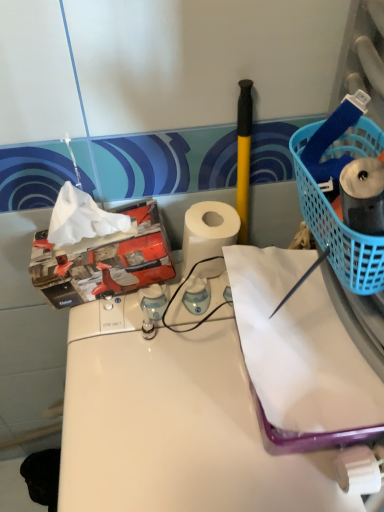
Question: From the image's perspective, is white glossy counter at center positioned above or below white matte paper towel at center?

Choices:
 (A) below
 (B) above

Answer: (A)

Question: Is point (195, 449) closer or farther from the camera than point (190, 249)?

Choices:
 (A) farther
 (B) closer

Answer: (B)

Question: Estimate the real-world distances between objects in this image. Which object is farther from the white matte paper towel at center?

Choices:
 (A) white glossy counter at center
 (B) blue plastic basket at right
 (C) white matte paper at center

Answer: (B)

Question: Considering the real-world distances, which object is farthest from the white glossy counter at center?

Choices:
 (A) white matte paper towel at center
 (B) white matte paper at center
 (C) blue plastic basket at right

Answer: (C)